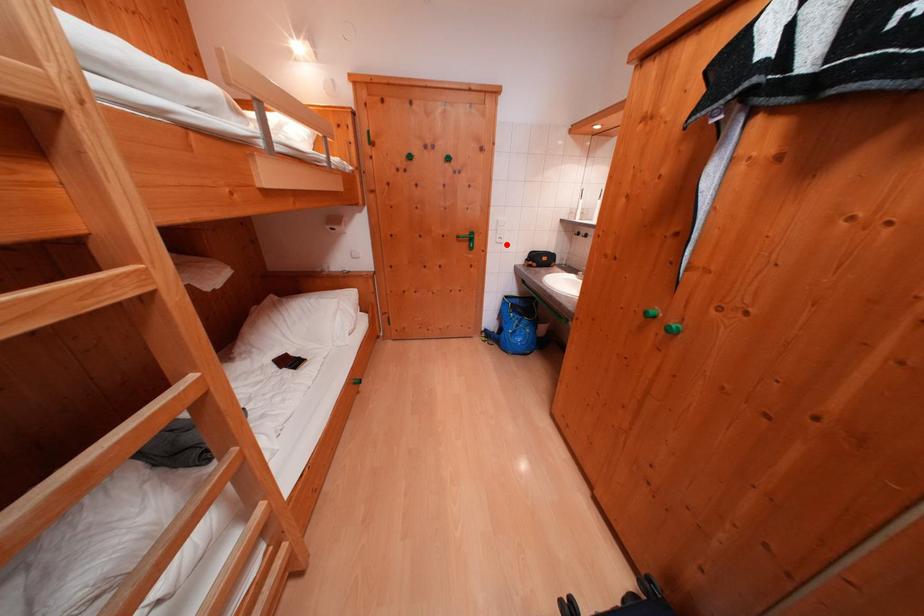
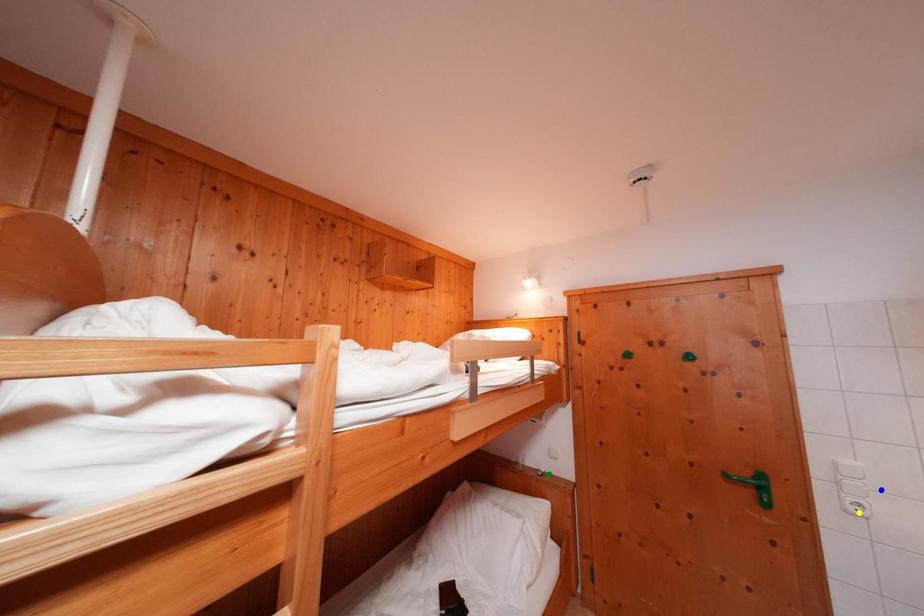
Question: I am providing you with two images of the same scene from different viewpoints. A red point is marked on the first image. You are given multiple points on the second image. Can you choose the point in image 2 that corresponds to the point in image 1?

Choices:
 (A) blue point
 (B) yellow point
 (C) green point

Answer: (B)